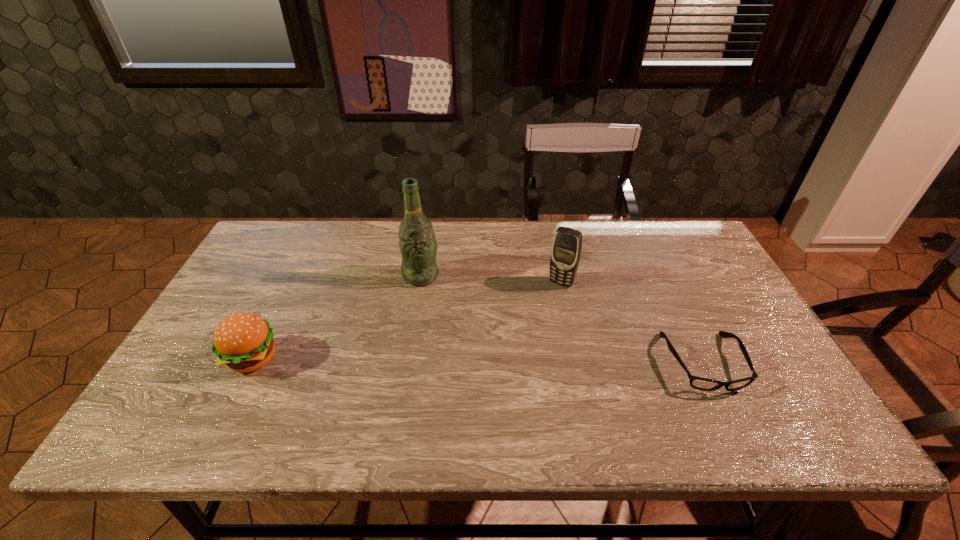
Identify the location of vacant space that's between the third object from left to right and the hamburger. (407, 321).

Find the location of `vacant region between the hamburger and the tallest object`. vacant region between the hamburger and the tallest object is located at coordinates coord(336,317).

This screenshot has width=960, height=540. Find the location of `free space between the cellular telephone and the beer bottle`. free space between the cellular telephone and the beer bottle is located at coordinates (492, 279).

You are a GUI agent. You are given a task and a screenshot of the screen. Output one action in this format:
    pyautogui.click(x=<x>, y=<y>)
    Task: Click on the empty space between the tallest object and the shortest object
    
    Given the screenshot: What is the action you would take?
    pyautogui.click(x=562, y=319)

The image size is (960, 540). I want to click on free space between the third tallest object and the shortest object, so click(x=477, y=361).

At what (x,y) coordinates should I click in order to perform the action: click on blank region between the cellular telephone and the third tallest object. Please return your answer as a coordinate pair (x, y). Looking at the image, I should click on (407, 321).

Locate which object is the second closest to the spectacles. Please provide its 2D coordinates. Your answer should be formatted as a tuple, i.e. [(x, y)], where the tuple contains the x and y coordinates of a point satisfying the conditions above.

[(418, 244)]

Identify which object is the third nearest to the third shortest object. Please provide its 2D coordinates. Your answer should be formatted as a tuple, i.e. [(x, y)], where the tuple contains the x and y coordinates of a point satisfying the conditions above.

[(243, 341)]

Identify the location of free space that satisfies the following two spatial constraints: 1. on the front side of the third shortest object; 2. on the right side of the third object from right to left. (420, 283).

The image size is (960, 540). What are the coordinates of `free location that satisfies the following two spatial constraints: 1. on the back side of the tallest object; 2. on the left side of the hamburger` in the screenshot? It's located at (293, 275).